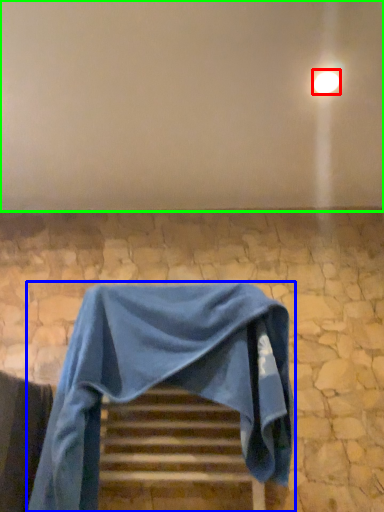
Question: Which object is positioned closest to light (highlighted by a red box)? Select from furniture (highlighted by a blue box) and backdrop (highlighted by a green box).

Choices:
 (A) furniture
 (B) backdrop

Answer: (B)